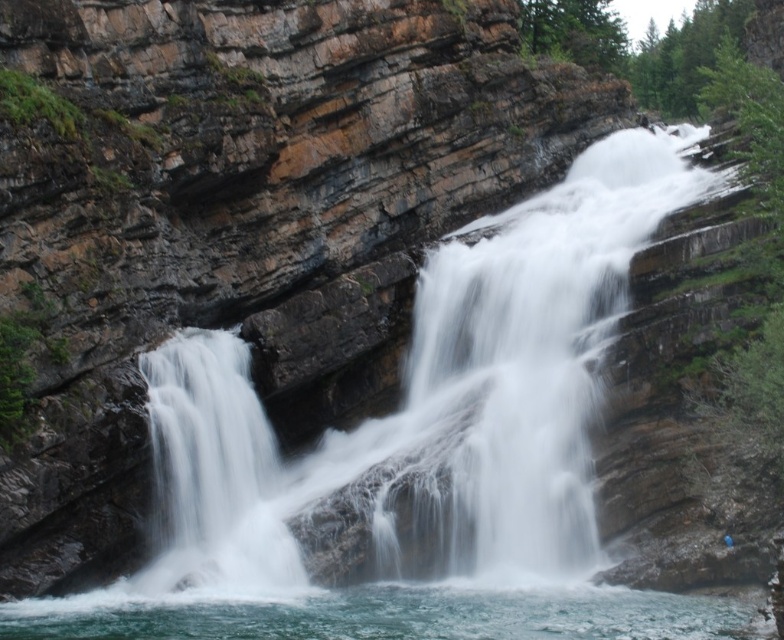
Is white frothy water at center positioned in front of white frothy water at lower center?

No.

Is point (557, 422) positioned behind point (403, 636)?

Yes.

The width and height of the screenshot is (784, 640). Identify the location of white frothy water at center. (429, 404).